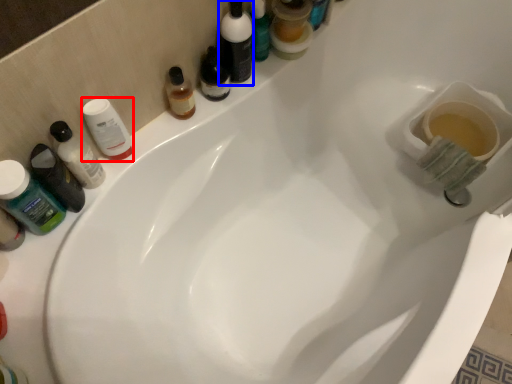
Question: Which object appears farthest to the camera in this image, mouthwash (highlighted by a red box) or toiletry (highlighted by a blue box)?

Choices:
 (A) mouthwash
 (B) toiletry

Answer: (B)